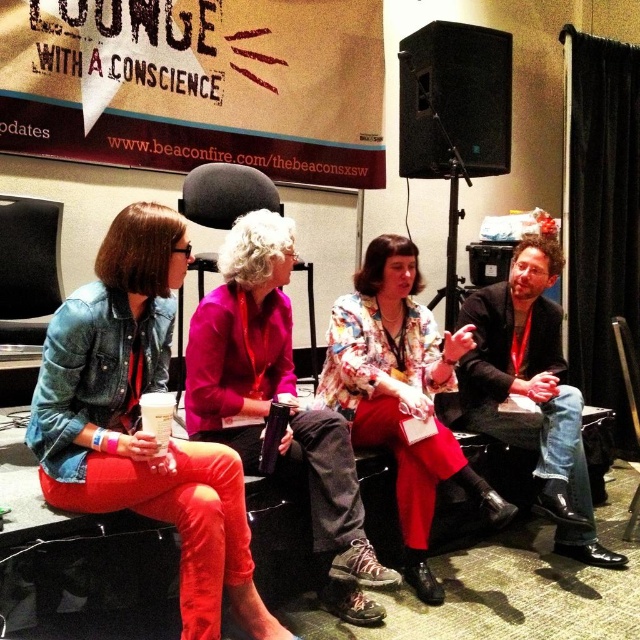
You are organizing a photo shoot and need to arrange the denim jacket at left and jeans at right in a way that they take up equal visual space in the final image. Given their current spatial relationship, what adjustment would you make?

The denim jacket at left currently occupies less space than the jeans at right. To balance their visual space, you should move the denim jacket at left closer to the camera or the jeans at right farther away, ensuring both objects take up equal proportions in the frame.

You are sitting in the front row of the audience facing the stage. You notice two black leather chairs. Which one is positioned higher up, the black leather chair at center or the black leather chair at lower right?

The black leather chair at center is located above the black leather chair at lower right, so it is positioned higher up.

You are sitting in the audience and want to know who is taller between the person wearing the denim jacket at left and the person wearing jeans at right. Based on the scene, can you determine which one is taller?

The denim jacket at left is not as tall as jeans at right, so the person wearing jeans at right is taller.